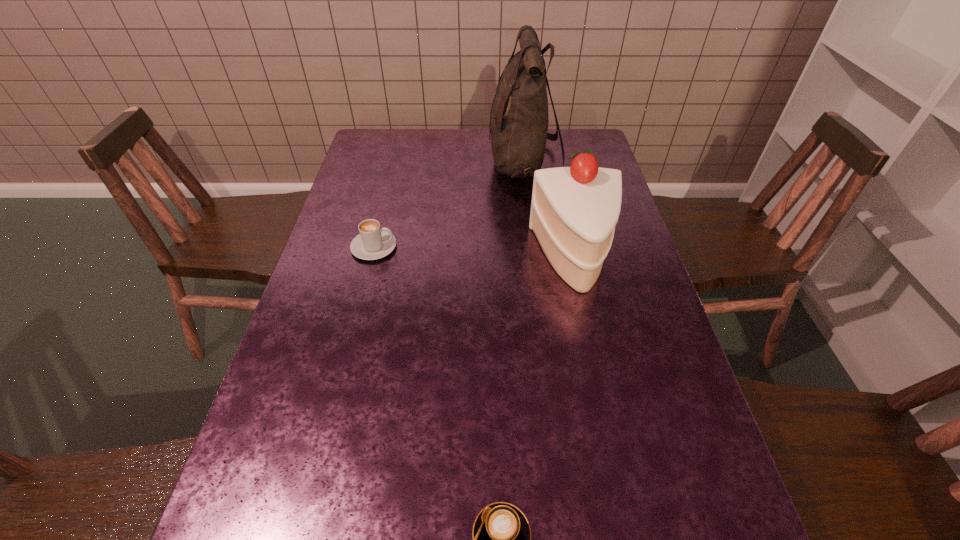
Identify the location of free space that is in between the farther cappuccino and the cake. Image resolution: width=960 pixels, height=540 pixels. (474, 253).

Image resolution: width=960 pixels, height=540 pixels. What are the coordinates of `object that ranks as the closest to the third shortest object` in the screenshot? It's located at click(519, 121).

Identify which object is located as the third nearest to the shorter cappuccino. Please provide its 2D coordinates. Your answer should be formatted as a tuple, i.e. [(x, y)], where the tuple contains the x and y coordinates of a point satisfying the conditions above.

[(519, 121)]

Locate an element on the screen. vacant space that satisfies the following two spatial constraints: 1. to the right of the cake; 2. on the right side of the second shortest object is located at coordinates (372, 258).

Find the location of a particular element. The width and height of the screenshot is (960, 540). free space in the image that satisfies the following two spatial constraints: 1. to the right of the left cappuccino; 2. on the back side of the cake is located at coordinates (372, 258).

The height and width of the screenshot is (540, 960). I want to click on free space that satisfies the following two spatial constraints: 1. on the open flap of the third shortest object; 2. on the left side of the tallest object, so click(536, 258).

Find the location of `free point that satisfies the following two spatial constraints: 1. to the right of the leftmost object; 2. on the right side of the cake`. free point that satisfies the following two spatial constraints: 1. to the right of the leftmost object; 2. on the right side of the cake is located at coordinates (372, 258).

What are the coordinates of `free spot that satisfies the following two spatial constraints: 1. to the right of the farther cappuccino; 2. on the back side of the cake` in the screenshot? It's located at click(372, 258).